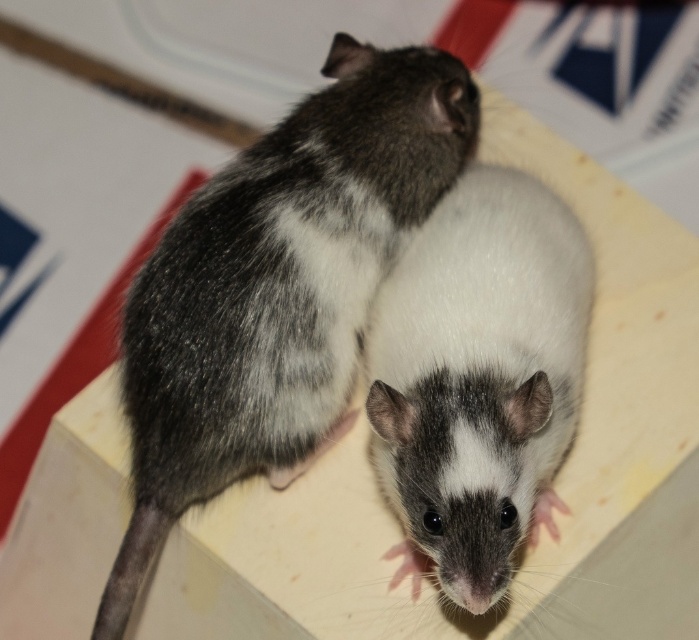
Question: Among these points, which one is farthest from the camera?

Choices:
 (A) (201, 214)
 (B) (468, 372)

Answer: (A)

Question: Can you confirm if gray-furred mouse at center is positioned to the left of white fur mouse at center?

Choices:
 (A) yes
 (B) no

Answer: (A)

Question: Which point is closer to the camera taking this photo?

Choices:
 (A) (370, 56)
 (B) (446, 262)

Answer: (B)

Question: Does gray-furred mouse at center have a greater width compared to white fur mouse at center?

Choices:
 (A) yes
 (B) no

Answer: (A)

Question: Is gray-furred mouse at center positioned before white fur mouse at center?

Choices:
 (A) no
 (B) yes

Answer: (A)